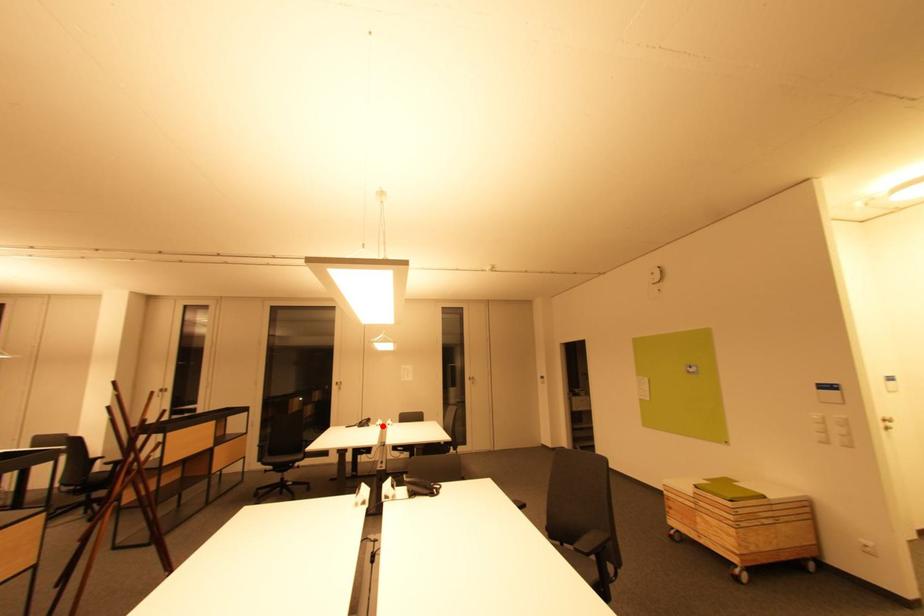
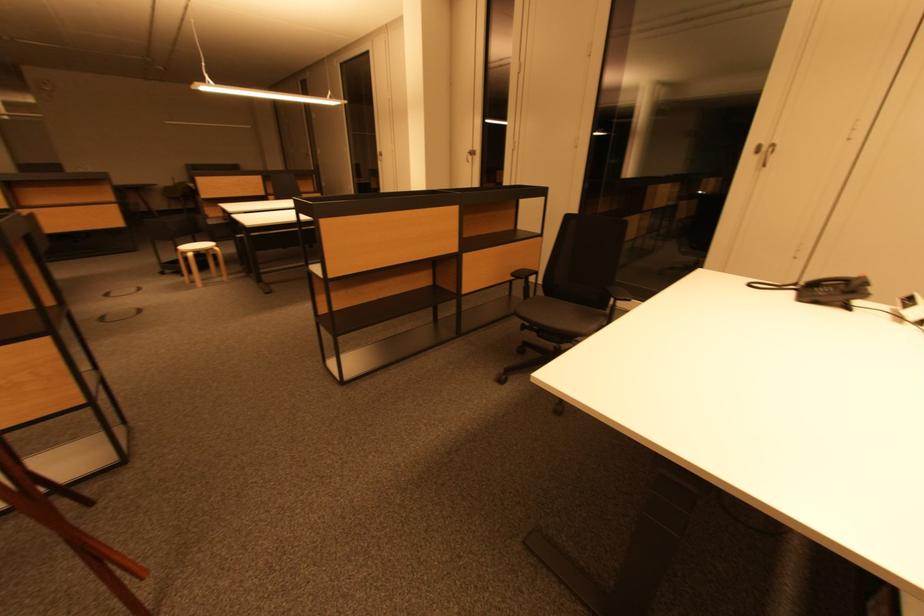
In the second image, find the point that corresponds to the highlighted location in the first image.

(918, 320)